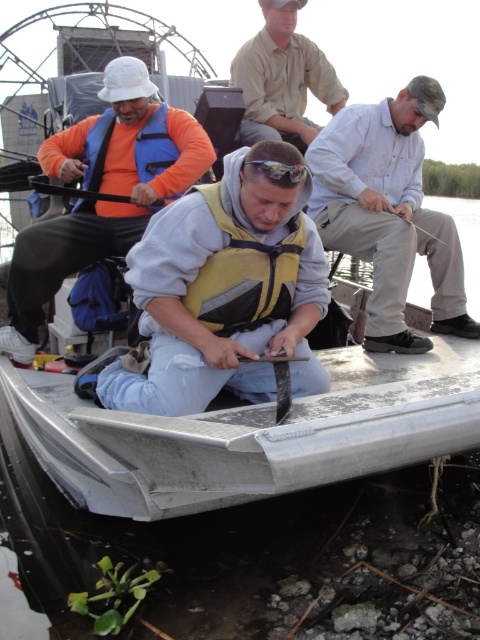
Based on the scene description, where is the light blue shirt at center located in the image?

The light blue shirt at center is located at point (388, 212) in the image.

Based on the coordinates provided, what object is located at point (251, 435) in the image?

The point (251, 435) indicates the silver metallic boat at center.

Looking at this image, you are on a boat and need to hand a fishing net to the person wearing the light blue shirt at center and the khaki cotton shirt at upper center. Which one can you reach first without moving from your current position?

The light blue shirt at center is closer to the viewer than the khaki cotton shirt at upper center, so you can reach the person wearing the light blue shirt at center first without moving.